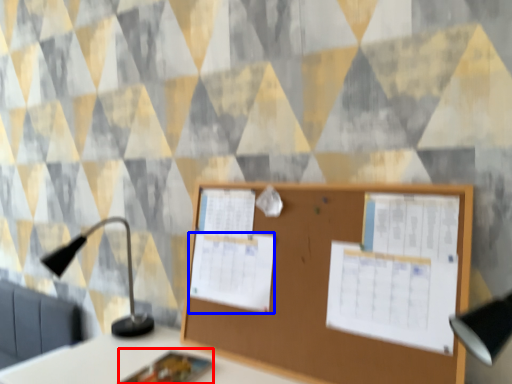
Question: Which object appears farthest to the camera in this image, notebook (highlighted by a red box) or poster (highlighted by a blue box)?

Choices:
 (A) notebook
 (B) poster

Answer: (B)